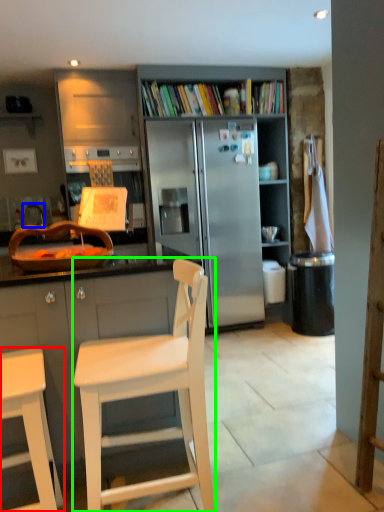
Question: Considering the real-world distances, which object is closest to chair (highlighted by a red box)? faucet (highlighted by a blue box) or chair (highlighted by a green box).

Choices:
 (A) faucet
 (B) chair

Answer: (B)